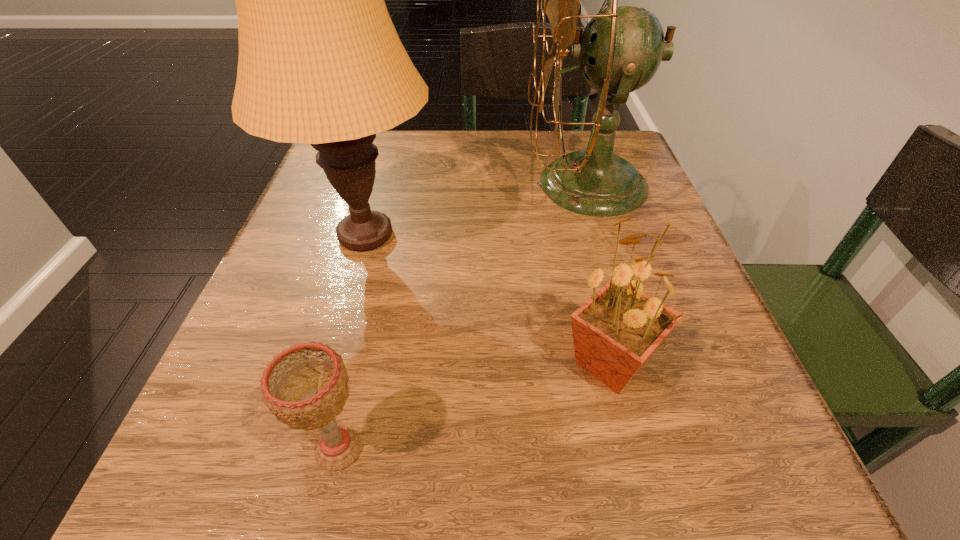
Image resolution: width=960 pixels, height=540 pixels. Find the location of `free point that satisfies the following two spatial constraints: 1. at the front of the third farthest object with flowers visible; 2. on the front side of the nearest object`. free point that satisfies the following two spatial constraints: 1. at the front of the third farthest object with flowers visible; 2. on the front side of the nearest object is located at coordinates (632, 449).